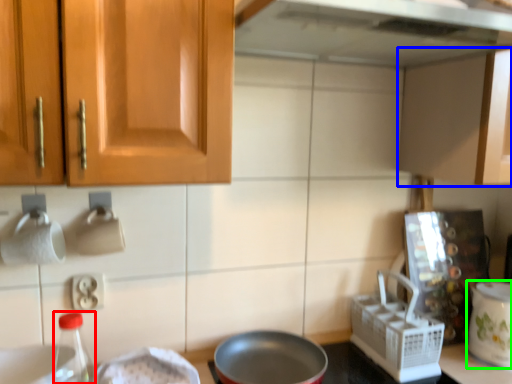
Question: Which is farther away from bottle (highlighted by a red box)? cabinetry (highlighted by a blue box) or kitchen appliance (highlighted by a green box)?

Choices:
 (A) cabinetry
 (B) kitchen appliance

Answer: (B)